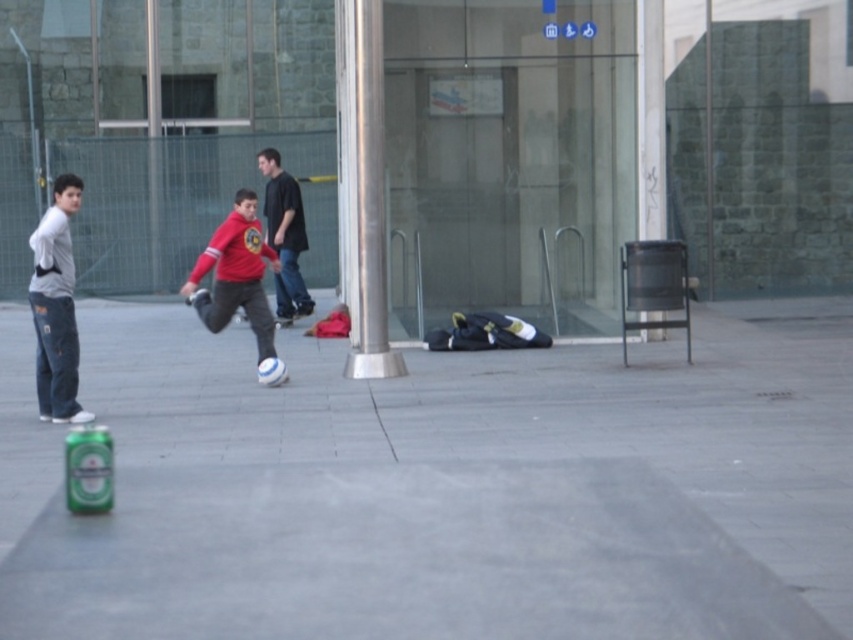
Who is lower down, gray concrete pavement at center or green matte can at lower left?

Positioned lower is gray concrete pavement at center.

Is point (810, 476) closer to camera compared to point (105, 474)?

No, it is behind (105, 474).

Between point (491, 532) and point (103, 433), which one is positioned behind?

The point (103, 433) is more distant.

Locate an element on the screen. gray concrete pavement at center is located at coordinates (437, 488).

Measure the distance between denim pants at left and matte black shirt at center.

denim pants at left and matte black shirt at center are 5.13 meters apart.

Does denim pants at left come behind matte black shirt at center?

No, denim pants at left is in front of matte black shirt at center.

The height and width of the screenshot is (640, 853). What do you see at coordinates (56, 307) in the screenshot?
I see `denim pants at left` at bounding box center [56, 307].

Where is `denim pants at left`? The image size is (853, 640). denim pants at left is located at coordinates (56, 307).

Does matte red hoodie at center have a lesser height compared to matte black shirt at center?

Yes, matte red hoodie at center is shorter than matte black shirt at center.

Find the location of `matte red hoodie at center`. matte red hoodie at center is located at coordinates point(238,282).

Where is `matte red hoodie at center`? Image resolution: width=853 pixels, height=640 pixels. matte red hoodie at center is located at coordinates (238, 282).